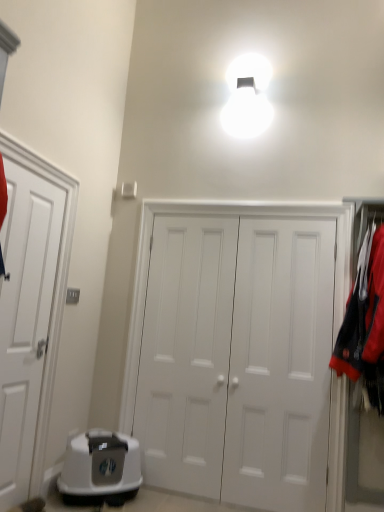
Question: Is white matte door at center, arranged as the first door when viewed from the right, to the left or to the right of white matte door at left, marked as the first door in a left-to-right arrangement, in the image?

Choices:
 (A) right
 (B) left

Answer: (A)

Question: From the image's perspective, relative to white matte door at left, marked as the first door in a left-to-right arrangement, is white matte door at center, which is counted as the 3th door, starting from the left, above or below?

Choices:
 (A) below
 (B) above

Answer: (A)

Question: Which object is positioned farthest from the white matte door at left, marked as the first door in a left-to-right arrangement?

Choices:
 (A) white matte door at center, arranged as the first door when viewed from the right
 (B) white matte door at center, marked as the 2th door in a left-to-right arrangement
 (C) white plastic litter box at lower left

Answer: (A)

Question: Which of these objects is positioned closest to the white plastic litter box at lower left?

Choices:
 (A) white matte door at left, the 3th door positioned from the right
 (B) white matte door at center, which is counted as the 3th door, starting from the left
 (C) white matte door at center, placed as the 2th door when sorted from right to left

Answer: (C)